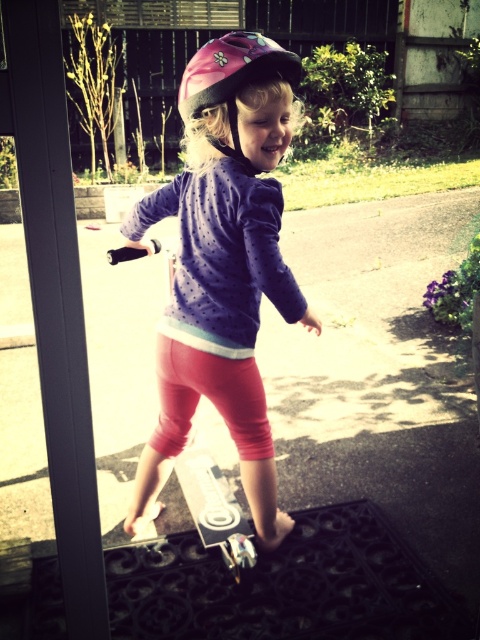
Is point (244, 352) farther from camera compared to point (232, 545)?

That is False.

Can you confirm if pink matte helmet at upper center is shorter than white glossy skateboard at center?

Incorrect, pink matte helmet at upper center's height does not fall short of white glossy skateboard at center's.

Between point (189, 204) and point (202, 454), which one is positioned in front?

Point (189, 204) is in front.

Image resolution: width=480 pixels, height=640 pixels. What are the coordinates of `pink matte helmet at upper center` in the screenshot? It's located at (224, 266).

Is pink glossy helmet at upper center to the right of white glossy skateboard at center from the viewer's perspective?

Yes, pink glossy helmet at upper center is to the right of white glossy skateboard at center.

Between point (285, 76) and point (188, 492), which one is positioned behind?

Positioned behind is point (188, 492).

Which is behind, point (239, 40) or point (228, 566)?

The point (228, 566) is more distant.

Image resolution: width=480 pixels, height=640 pixels. What are the coordinates of `pink glossy helmet at upper center` in the screenshot? It's located at (231, 74).

Can you confirm if pink matte helmet at upper center is shorter than pink glossy helmet at upper center?

In fact, pink matte helmet at upper center may be taller than pink glossy helmet at upper center.

Can you confirm if pink matte helmet at upper center is positioned to the left of pink glossy helmet at upper center?

Yes, pink matte helmet at upper center is to the left of pink glossy helmet at upper center.

This screenshot has height=640, width=480. Find the location of `pink matte helmet at upper center`. pink matte helmet at upper center is located at coordinates (224, 266).

The image size is (480, 640). In order to click on pink matte helmet at upper center in this screenshot , I will do `click(224, 266)`.